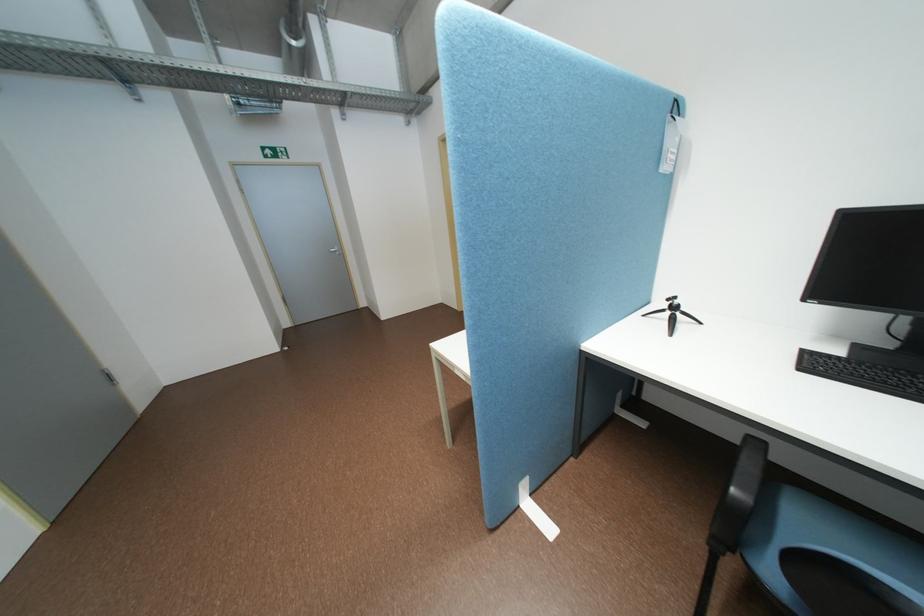
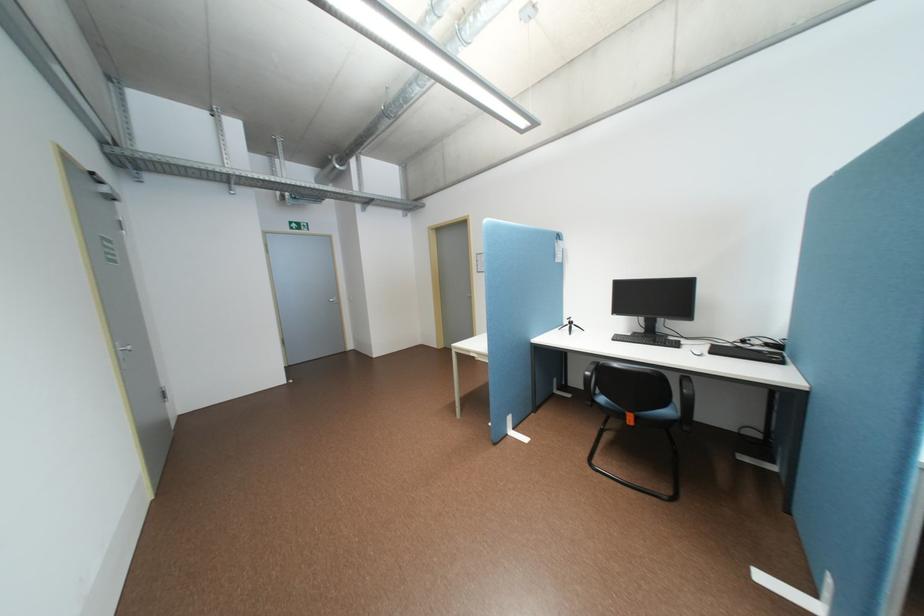
Find the pixel in the second image that matches the point at 354,100 in the first image.

(379, 201)